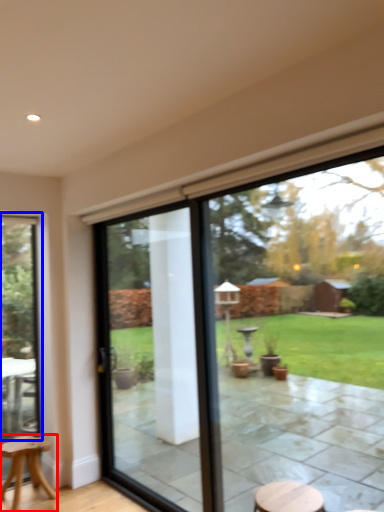
Question: Among these objects, which one is nearest to the camera, stool (highlighted by a red box) or window (highlighted by a blue box)?

Choices:
 (A) stool
 (B) window

Answer: (A)